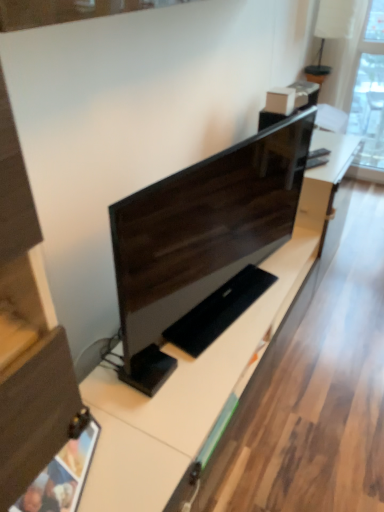
Where is `matte black monitor at center`? The image size is (384, 512). matte black monitor at center is located at coordinates (201, 236).

This screenshot has width=384, height=512. Describe the element at coordinates (201, 236) in the screenshot. I see `matte black monitor at center` at that location.

The height and width of the screenshot is (512, 384). What do you see at coordinates (37, 413) in the screenshot?
I see `matte wood drawer at lower left` at bounding box center [37, 413].

Identify the location of matte wood drawer at lower left. The height and width of the screenshot is (512, 384). (37, 413).

What is the approximate width of matte wood drawer at lower left?

It is 1.71 inches.

The width and height of the screenshot is (384, 512). I want to click on matte black monitor at center, so click(x=201, y=236).

Is matte black monitor at center to the right of matte wood drawer at lower left from the viewer's perspective?

Indeed, matte black monitor at center is positioned on the right side of matte wood drawer at lower left.

Between matte black monitor at center and matte wood drawer at lower left, which one is positioned behind?

matte black monitor at center is further from the camera.

Between point (129, 384) and point (63, 379), which one is positioned behind?

The point (129, 384) is more distant.

From the image's perspective, between matte black monitor at center and matte wood drawer at lower left, who is located below?

matte wood drawer at lower left, from the image's perspective.

From a real-world perspective, which object stands above the other?

From a 3D spatial view, matte black monitor at center is above.

Between matte black monitor at center and matte wood drawer at lower left, which one has larger width?

matte black monitor at center is wider.

Which of these two, matte black monitor at center or matte wood drawer at lower left, stands taller?

matte black monitor at center is taller.

Between matte black monitor at center and matte wood drawer at lower left, which one has larger size?

matte black monitor at center is bigger.

Is matte black monitor at center inside or outside of matte wood drawer at lower left?

matte black monitor at center exists outside the volume of matte wood drawer at lower left.

Is there a large distance between matte black monitor at center and matte wood drawer at lower left?

matte black monitor at center is near matte wood drawer at lower left, not far away.

Is matte black monitor at center oriented away from matte wood drawer at lower left?

That's not correct — matte black monitor at center is not looking away from matte wood drawer at lower left.

How many degrees apart are the facing directions of matte black monitor at center and matte wood drawer at lower left?

The angle between the facing direction of matte black monitor at center and the facing direction of matte wood drawer at lower left is 34 degrees.

How distant is matte black monitor at center from matte wood drawer at lower left?

matte black monitor at center is 24.07 inches from matte wood drawer at lower left.

What are the coordinates of `drawer below the matte black monitor at center (from the image's perspective)` in the screenshot? It's located at (37, 413).

Considering the relative positions of matte wood drawer at lower left and matte black monitor at center in the image provided, is matte wood drawer at lower left to the left of matte black monitor at center from the viewer's perspective?

Indeed, matte wood drawer at lower left is positioned on the left side of matte black monitor at center.

Which object is more forward, matte wood drawer at lower left or matte black monitor at center?

matte wood drawer at lower left.

Which point is more forward, [15,464] or [220,166]?

The point [15,464] is in front.

Consider the image. From the image's perspective, does matte wood drawer at lower left appear lower than matte black monitor at center?

Indeed, from the image's perspective, matte wood drawer at lower left is shown beneath matte black monitor at center.

From a real-world perspective, relative to matte black monitor at center, is matte wood drawer at lower left vertically above or below?

Clearly, from a real-world perspective, matte wood drawer at lower left is below matte black monitor at center.

Which of these two, matte wood drawer at lower left or matte black monitor at center, is thinner?

With smaller width is matte wood drawer at lower left.

Who is taller, matte wood drawer at lower left or matte black monitor at center?

Standing taller between the two is matte black monitor at center.

Is matte wood drawer at lower left bigger than matte black monitor at center?

Incorrect, matte wood drawer at lower left is not larger than matte black monitor at center.

Is matte wood drawer at lower left outside of matte black monitor at center?

Indeed, matte wood drawer at lower left is completely outside matte black monitor at center.

Are matte wood drawer at lower left and matte black monitor at center located far from each other?

matte wood drawer at lower left is actually quite close to matte black monitor at center.

Is matte wood drawer at lower left positioned with its back to matte black monitor at center?

matte wood drawer at lower left does not have its back to matte black monitor at center.

How much distance is there between matte wood drawer at lower left and matte black monitor at center?

The distance of matte wood drawer at lower left from matte black monitor at center is 61.15 centimeters.

Locate an element on the screen. The height and width of the screenshot is (512, 384). drawer below the matte black monitor at center (from a real-world perspective) is located at coordinates (37, 413).

Find the location of a particular element. The height and width of the screenshot is (512, 384). drawer located underneath the matte black monitor at center (from a real-world perspective) is located at coordinates (37, 413).

There is a matte wood drawer at lower left. Identify the location of computer monitor above it (from a real-world perspective). (x=201, y=236).